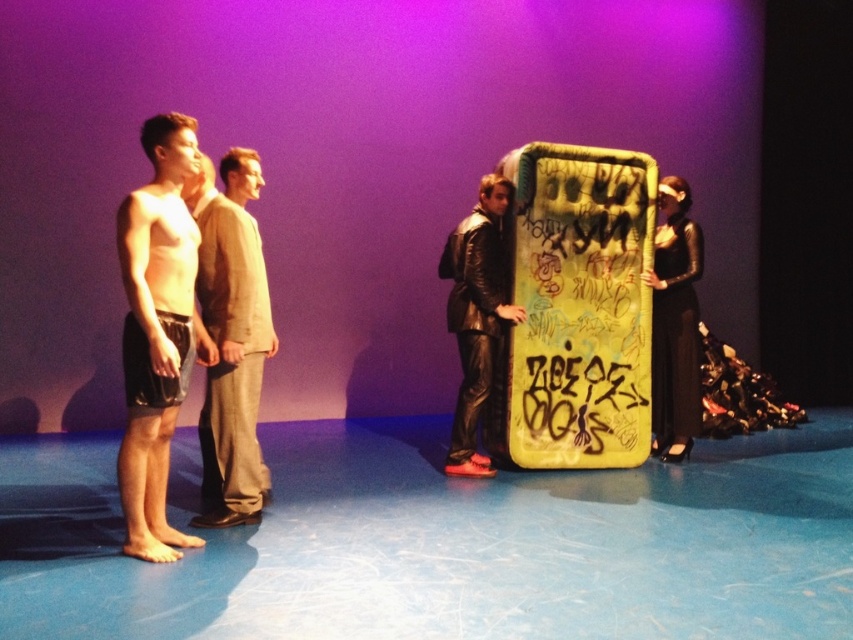
You are a stagehand who needs to move the beige fabric pants at center and the black leather dress at right to the left side of the stage. Which item should you move first to ensure they are arranged in the correct order as seen from the audience?

The beige fabric pants at center should be moved first to the left side of the stage so that it is positioned on the left side of the black leather dress at right, maintaining their original spatial relationship.